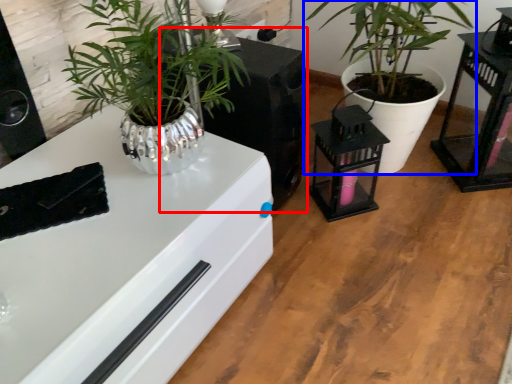
Question: Which of the following is the closest to the observer, appliance (highlighted by a red box) or houseplant (highlighted by a blue box)?

Choices:
 (A) appliance
 (B) houseplant

Answer: (B)